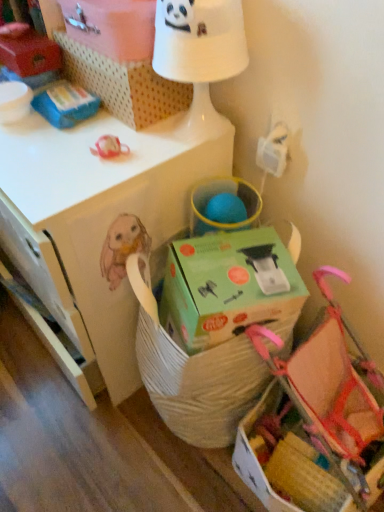
Question: Is white glossy table lamp at upper center bigger or smaller than white matte desk at center?

Choices:
 (A) small
 (B) big

Answer: (A)

Question: In the image, is white glossy table lamp at upper center positioned in front of or behind white matte desk at center?

Choices:
 (A) front
 (B) behind

Answer: (A)

Question: Which object is the closest to the white cardboard box at upper center, which is the first storage box in right-to-left order?

Choices:
 (A) green cardboard box at center, the 2th cardboard box viewed from the top
 (B) white glossy table lamp at upper center
 (C) pink fabric baby carriage at lower right
 (D) white cardboard box at upper center, the 1th cardboard box when ordered from top to bottom
 (E) matte plastic storage box at upper left, which appears as the 2th storage box when viewed from the right

Answer: (D)

Question: Based on their relative distances, which object is nearer to the white cardboard box at upper center, the second storage box in the left-to-right sequence?

Choices:
 (A) white glossy table lamp at upper center
 (B) white matte desk at center
 (C) matte plastic storage box at upper left, which appears as the 2th storage box when viewed from the right
 (D) green cardboard box at center, which ranks as the first cardboard box in bottom-to-top order
 (E) pink fabric baby carriage at lower right

Answer: (A)